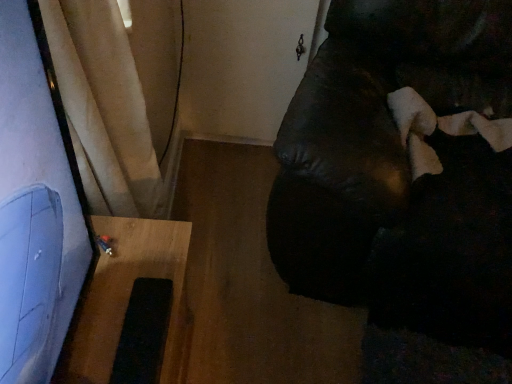
I want to click on leather couch at right, so click(402, 187).

What is the approximate width of leather couch at right?

leather couch at right is 3.39 feet wide.

Measure the distance between point [317,243] and camera.

A distance of 1.18 meters exists between point [317,243] and camera.

Image resolution: width=512 pixels, height=384 pixels. Describe the element at coordinates (402, 187) in the screenshot. I see `leather couch at right` at that location.

In order to click on leather couch at right in this screenshot , I will do `click(402, 187)`.